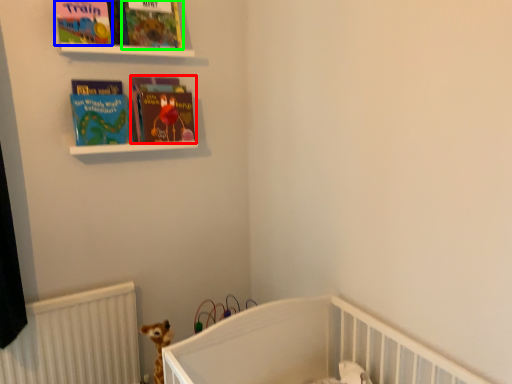
Question: Which object is positioned closest to book (highlighted by a red box)? Select from book cover (highlighted by a blue box) and book cover (highlighted by a green box).

Choices:
 (A) book cover
 (B) book cover

Answer: (B)